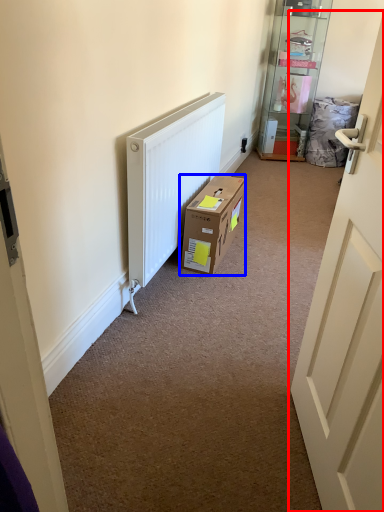
Question: Which point is further to the camera, door (highlighted by a red box) or box (highlighted by a blue box)?

Choices:
 (A) door
 (B) box

Answer: (B)